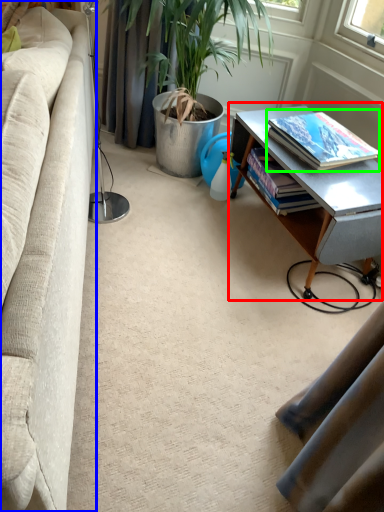
Question: Which object is the closest to the table (highlighted by a red box)? Choose among these: studio couch (highlighted by a blue box) or book (highlighted by a green box).

Choices:
 (A) studio couch
 (B) book

Answer: (B)